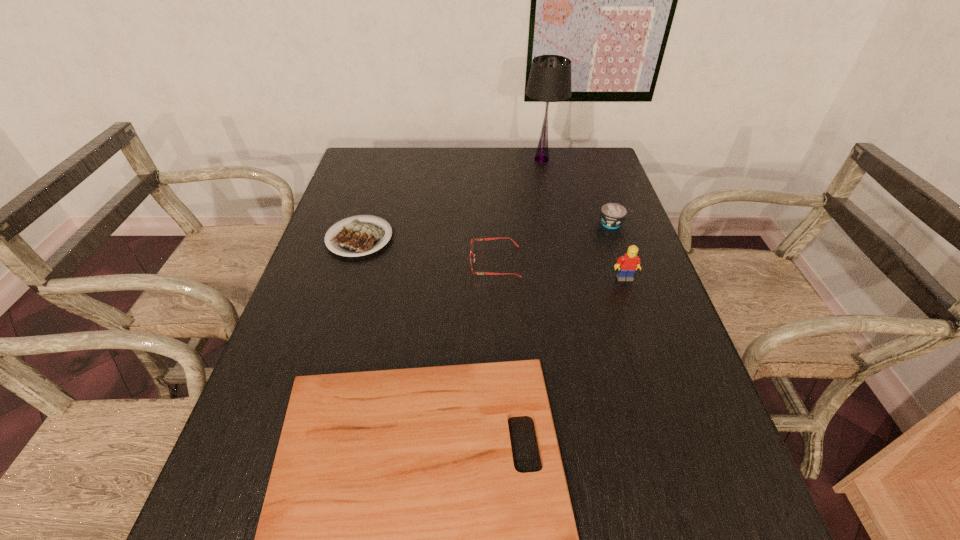
You are a GUI agent. You are given a task and a screenshot of the screen. Output one action in this format:
    pyautogui.click(x=<x>, y=<y>)
    Task: Click on the lampshade
    The height and width of the screenshot is (540, 960).
    Given the screenshot: What is the action you would take?
    pyautogui.click(x=550, y=76)

Identify the location of the tallest object. (550, 76).

Image resolution: width=960 pixels, height=540 pixels. Identify the location of Lego. (627, 264).

This screenshot has width=960, height=540. In order to click on the third tallest object in this screenshot , I will do 612,214.

The image size is (960, 540). I want to click on the third shortest object, so 482,239.

You are a GUI agent. You are given a task and a screenshot of the screen. Output one action in this format:
    pyautogui.click(x=<x>, y=<y>)
    Task: Click on the second shortest object
    
    Given the screenshot: What is the action you would take?
    pyautogui.click(x=358, y=238)

At what (x,y) coordinates should I click in order to perform the action: click on vacant area situated on the front-facing side of the farthest object. Please return your answer as a coordinate pair (x, y). The image size is (960, 540). Looking at the image, I should click on (434, 159).

Where is `vacant space located 0.310m on the front-facing side of the farthest object`? The image size is (960, 540). vacant space located 0.310m on the front-facing side of the farthest object is located at coordinates (434, 159).

Locate an element on the screen. This screenshot has height=540, width=960. free location located on the front-facing side of the farthest object is located at coordinates (479, 159).

At what (x,y) coordinates should I click in order to perform the action: click on vacant space located 0.070m on the front-facing side of the second tallest object. Please return your answer as a coordinate pair (x, y). The image size is (960, 540). Looking at the image, I should click on (633, 302).